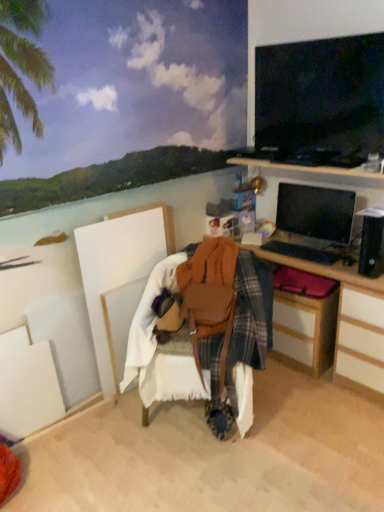
The image size is (384, 512). In order to click on free location in front of plaid fabric drawer at right in this screenshot , I will do `click(310, 392)`.